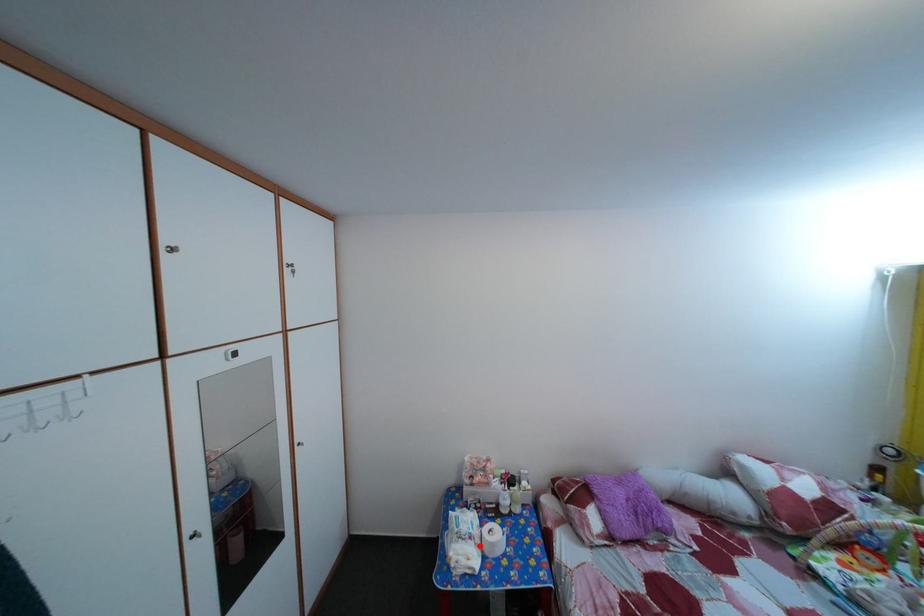
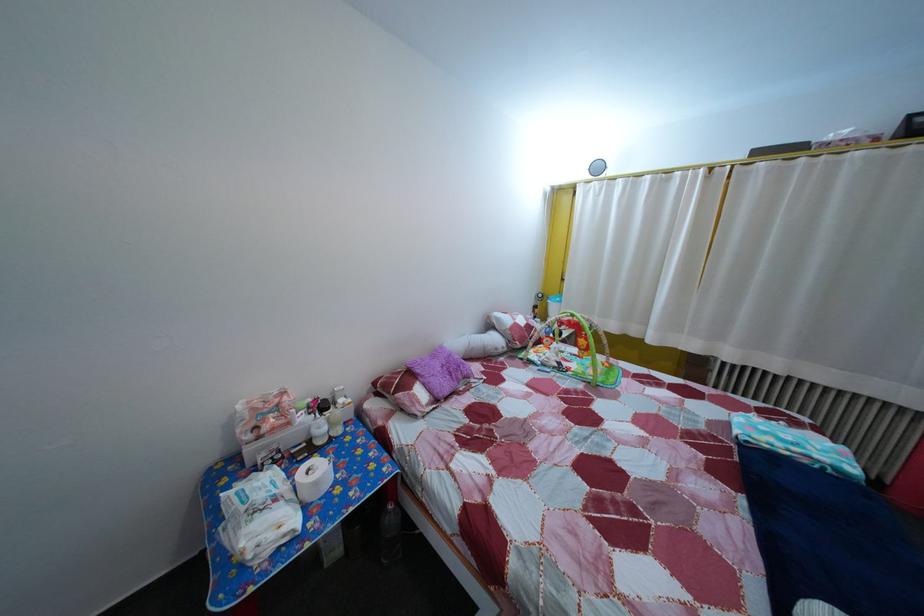
Question: I am providing you with two images of the same scene from different viewpoints. Given a red point in image1, look at the same physical point in image2. Is it:

Choices:
 (A) Closer to the viewpoint
 (B) Farther from the viewpoint

Answer: (A)